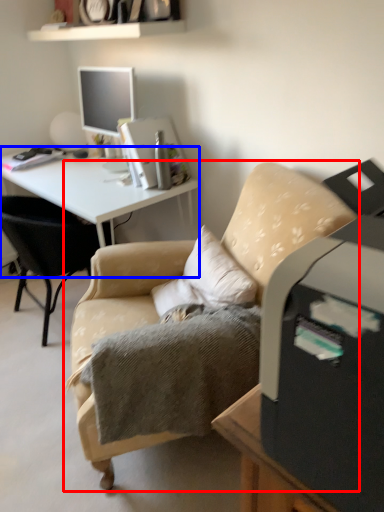
Question: Among these objects, which one is nearest to the camera, chair (highlighted by a red box) or desk (highlighted by a blue box)?

Choices:
 (A) chair
 (B) desk

Answer: (A)